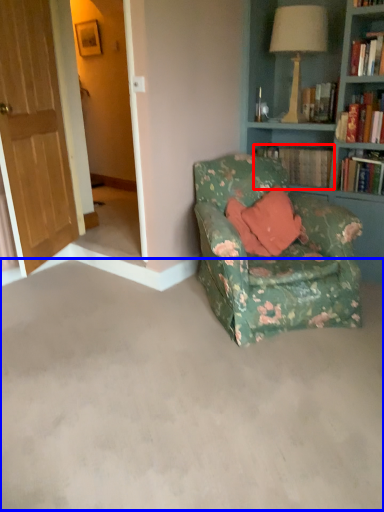
Question: Which object appears farthest to the camera in this image, book (highlighted by a red box) or concrete (highlighted by a blue box)?

Choices:
 (A) book
 (B) concrete

Answer: (A)